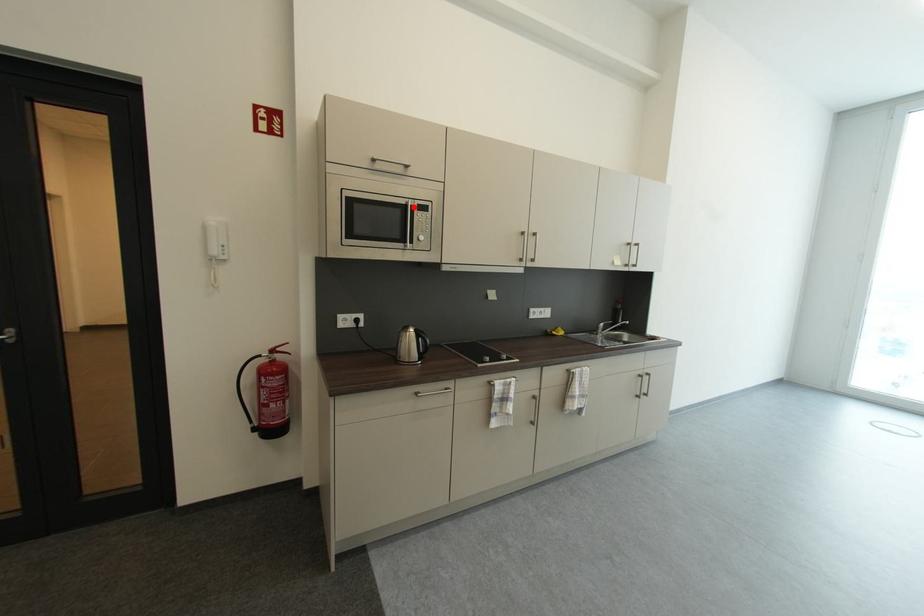
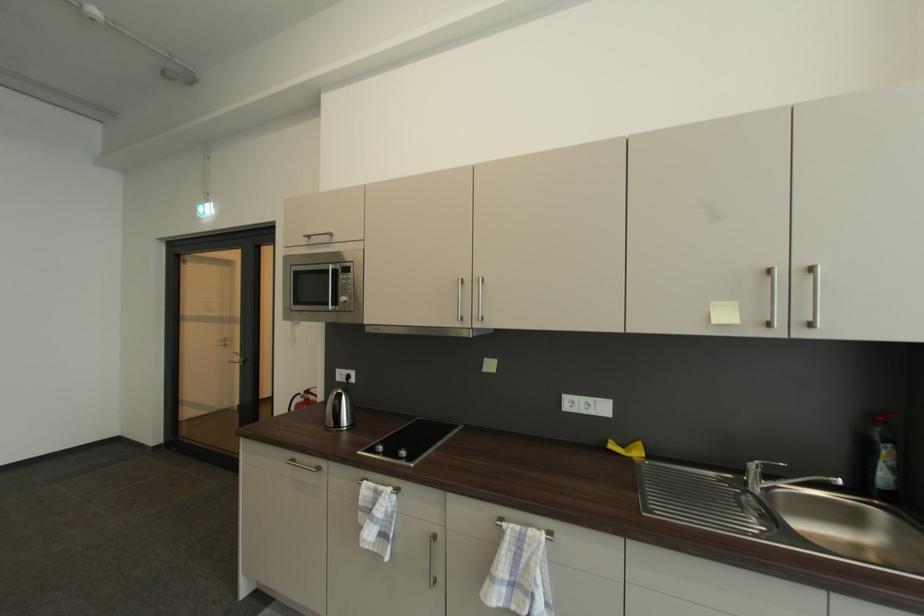
Question: I am providing you with two images of the same scene from different viewpoints. A red point is marked on the first image. Is the red point's position out of view in image 2?

Choices:
 (A) Yes
 (B) No

Answer: (B)